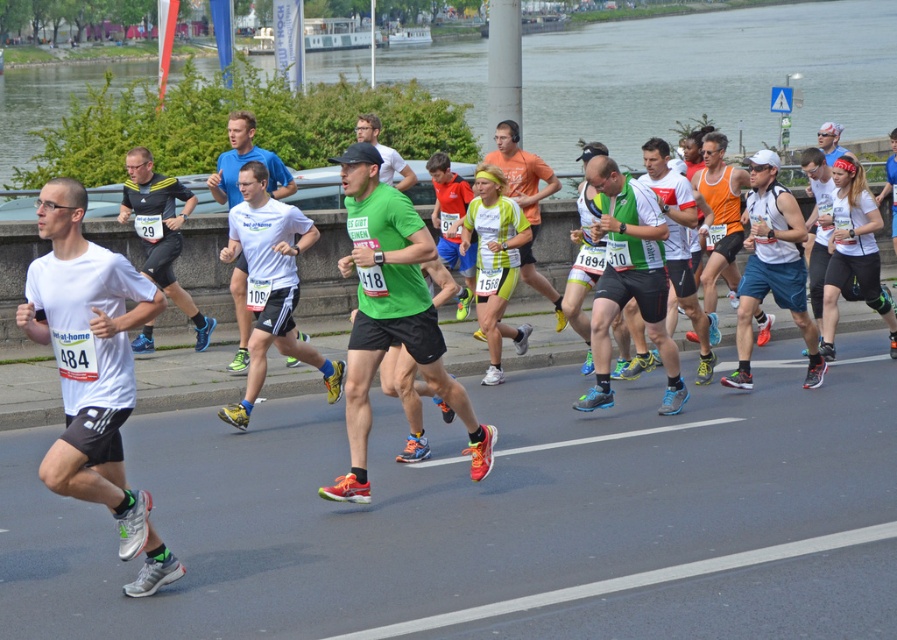
Can you confirm if white matte tank top at center is shorter than white matte shirt at center?

Incorrect, white matte tank top at center's height does not fall short of white matte shirt at center's.

Does white matte tank top at center appear over white matte shirt at center?

Actually, white matte tank top at center is below white matte shirt at center.

Who is more distant from viewer, (873, 248) or (241, 148)?

Positioned behind is point (873, 248).

Identify the location of white matte tank top at center. This screenshot has height=640, width=897. (852, 252).

Which of these two, matte black shirt at left or white matte tank top at center, stands taller?

white matte tank top at center

Does matte black shirt at left appear over white matte tank top at center?

Yes, matte black shirt at left is above white matte tank top at center.

Who is more forward, (138, 208) or (841, 200)?

Point (841, 200) is in front.

The width and height of the screenshot is (897, 640). In order to click on matte black shirt at left in this screenshot , I will do `click(160, 230)`.

Which of these two, green matte shirt at center or yellow-green jersey at center, stands taller?

green matte shirt at center is taller.

Measure the distance between point (425, 380) and camera.

They are 29.66 feet apart.

You are a GUI agent. You are given a task and a screenshot of the screen. Output one action in this format:
    pyautogui.click(x=<x>, y=<y>)
    Task: Click on the green matte shirt at center
    This screenshot has width=897, height=640.
    Given the screenshot: What is the action you would take?
    pyautogui.click(x=390, y=314)